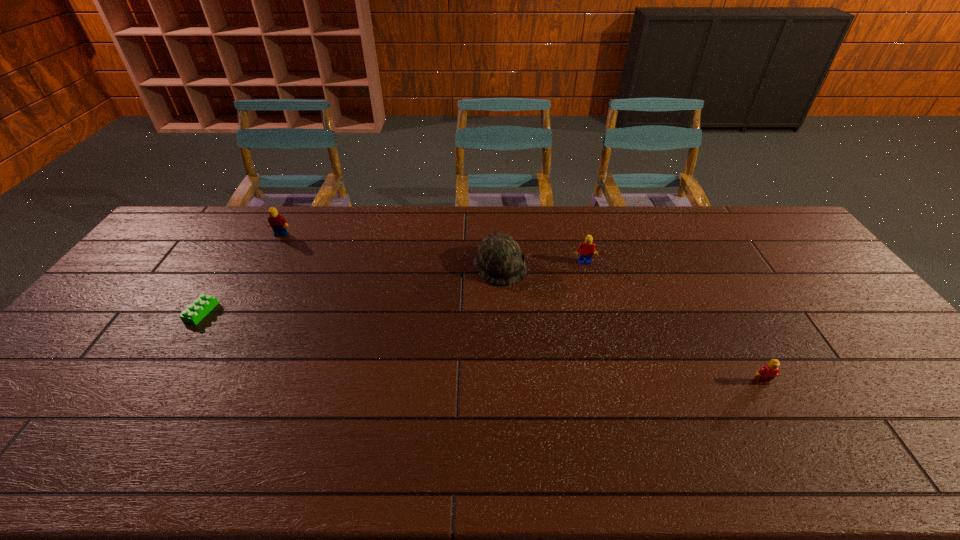
This screenshot has width=960, height=540. What are the coordinates of `free space located 0.380m on the front-facing side of the second object from right to left` in the screenshot? It's located at (610, 362).

This screenshot has height=540, width=960. I want to click on vacant space situated 0.390m on the left of the headwear, so click(353, 266).

Where is `free space located on the face of the rightmost object`? free space located on the face of the rightmost object is located at coordinates (798, 447).

Image resolution: width=960 pixels, height=540 pixels. I want to click on free space located 0.350m on the front of the third farthest Lego, so click(117, 443).

The image size is (960, 540). I want to click on object at the far edge, so click(x=278, y=223).

In the image, there is a desktop. In order to click on free space at the far edge in this screenshot , I will do `click(314, 243)`.

The height and width of the screenshot is (540, 960). Identify the location of vacant space at the near edge of the desktop. (146, 456).

Locate an element on the screen. vacant space at the left edge is located at coordinates (78, 346).

Find the location of a particular element. This screenshot has height=540, width=960. free location at the right edge is located at coordinates (922, 433).

Identify the location of vacant space at the far left corner of the desktop. The width and height of the screenshot is (960, 540). (193, 226).